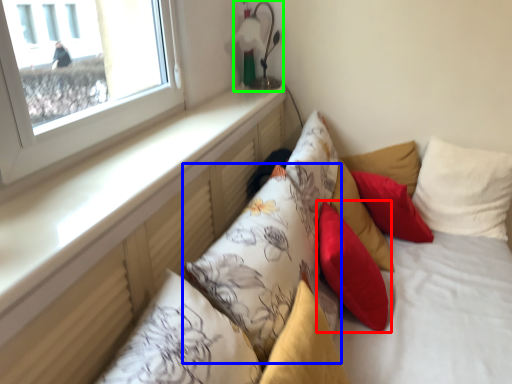
Question: Considering the real-world distances, which object is farthest from pillow (highlighted by a red box)? pillow (highlighted by a blue box) or table lamp (highlighted by a green box)?

Choices:
 (A) pillow
 (B) table lamp

Answer: (B)